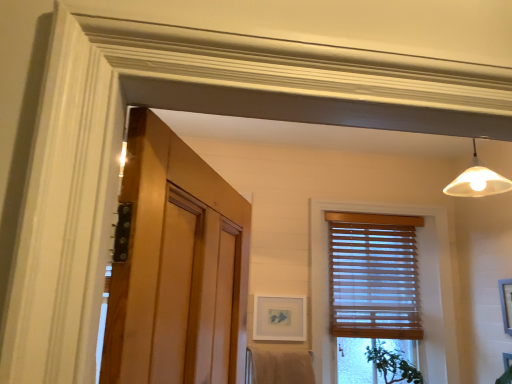
Question: Considering the positions of wooden blinds at center and matte white picture frame at center, which is the 2th picture frame in front-to-back order, in the image, is wooden blinds at center bigger or smaller than matte white picture frame at center, which is the 2th picture frame in front-to-back order,?

Choices:
 (A) small
 (B) big

Answer: (B)

Question: Considering the positions of wooden blinds at center and matte white picture frame at center, acting as the second picture frame starting from the right, in the image, is wooden blinds at center wider or thinner than matte white picture frame at center, acting as the second picture frame starting from the right,?

Choices:
 (A) wide
 (B) thin

Answer: (A)

Question: Which object is the closest to the wooden blinds at right?

Choices:
 (A) wooden blinds at center
 (B) green leafy plant at lower right
 (C) matte white picture frame at center, which is the 2th picture frame in front-to-back order
 (D) white matte picture frame at right, the 2th picture frame from the back
 (E) beige cotton bath towel at lower center

Answer: (A)

Question: Estimate the real-world distances between objects in this image. Which object is closer to the wooden blinds at center?

Choices:
 (A) green leafy plant at lower right
 (B) wooden blinds at right
 (C) beige cotton bath towel at lower center
 (D) white matte picture frame at right, acting as the first picture frame starting from the right
 (E) matte white picture frame at center, acting as the second picture frame starting from the right

Answer: (B)